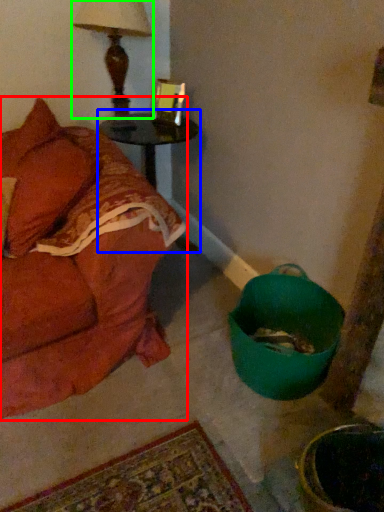
Question: Considering the real-world distances, which object is farthest from studio couch (highlighted by a red box)? table (highlighted by a blue box) or table lamp (highlighted by a green box)?

Choices:
 (A) table
 (B) table lamp

Answer: (B)